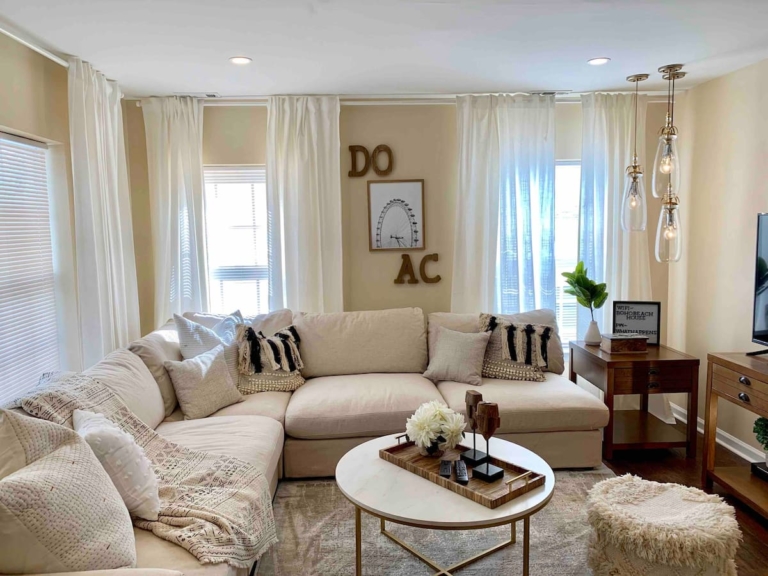
Image resolution: width=768 pixels, height=576 pixels. I want to click on curtain, so click(96, 226), click(176, 227), click(308, 221), click(515, 223), click(613, 126).